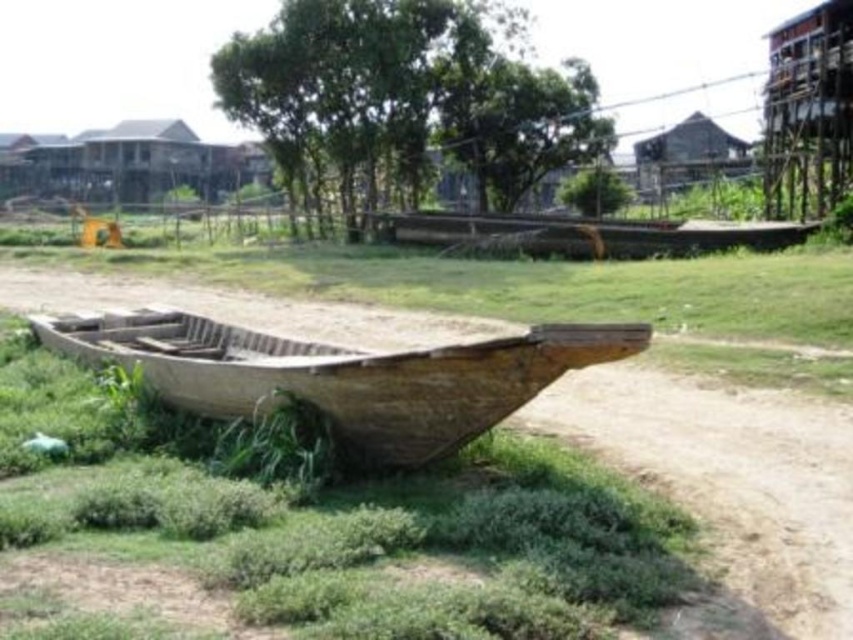
Question: Is wooden canoe at center smaller than brown wooden hut at upper right?

Choices:
 (A) no
 (B) yes

Answer: (B)

Question: Which object is closer to the camera taking this photo?

Choices:
 (A) wooden canoe at center
 (B) weathered wood boat at center
 (C) brown wooden hut at upper right
 (D) brown wooden boat at center

Answer: (B)

Question: Which object is the farthest from the wooden canoe at center?

Choices:
 (A) brown dirt track at lower right
 (B) weathered wood boat at center
 (C) brown wooden boat at center

Answer: (B)

Question: Considering the relative positions of brown wooden boat at center and wooden canoe at center in the image provided, where is brown wooden boat at center located with respect to wooden canoe at center?

Choices:
 (A) above
 (B) below

Answer: (B)

Question: Considering the real-world distances, which object is closest to the brown wooden hut at upper right?

Choices:
 (A) wooden canoe at center
 (B) weathered wood boat at center

Answer: (A)

Question: Does wooden canoe at center have a smaller size compared to brown wooden hut at upper right?

Choices:
 (A) no
 (B) yes

Answer: (B)